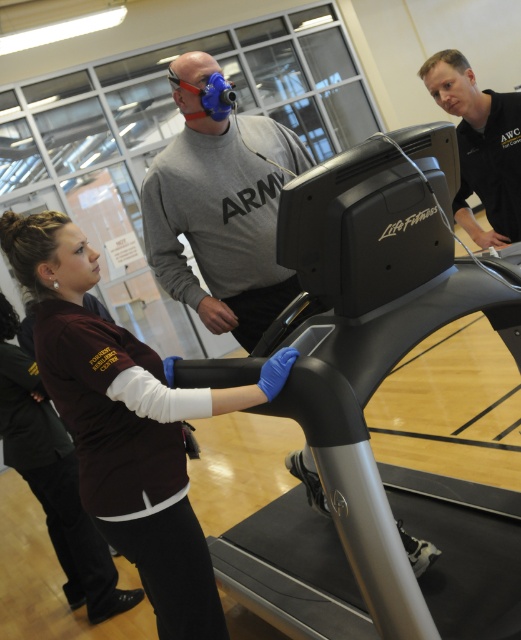
Question: Considering the relative positions of gray matte sweatshirt at center and black matte shirt at upper right in the image provided, where is gray matte sweatshirt at center located with respect to black matte shirt at upper right?

Choices:
 (A) below
 (B) above

Answer: (A)

Question: Does maroon jersey at center have a greater width compared to black matte shirt at upper right?

Choices:
 (A) no
 (B) yes

Answer: (B)

Question: Estimate the real-world distances between objects in this image. Which object is farther from the gray matte sweatshirt at center?

Choices:
 (A) maroon jersey at center
 (B) maroon fabric shirt at center

Answer: (A)

Question: Which object is farther from the camera taking this photo?

Choices:
 (A) maroon jersey at center
 (B) gray matte sweatshirt at center

Answer: (A)

Question: Can you confirm if maroon jersey at center is positioned below black matte shirt at upper right?

Choices:
 (A) yes
 (B) no

Answer: (A)

Question: Which of the following is the closest to the observer?

Choices:
 (A) black matte shirt at upper right
 (B) black plastic treadmill at center

Answer: (B)